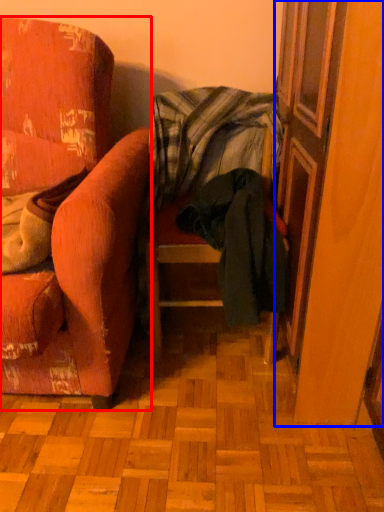
Question: Among these objects, which one is nearest to the camera, chair (highlighted by a red box) or screen door (highlighted by a blue box)?

Choices:
 (A) chair
 (B) screen door

Answer: (A)